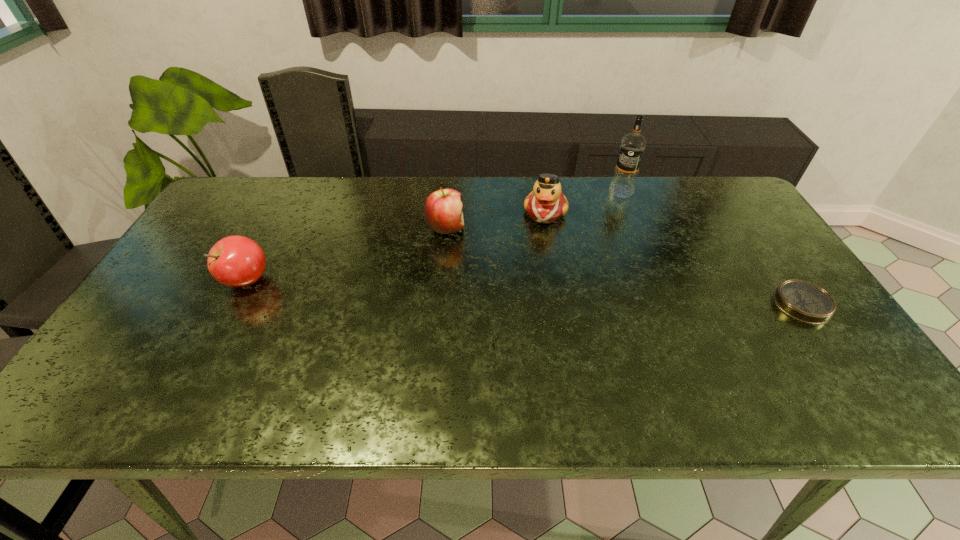
The width and height of the screenshot is (960, 540). In order to click on the leftmost object in this screenshot , I will do tap(236, 261).

At what (x,y) coordinates should I click in order to perform the action: click on the left apple. Please return your answer as a coordinate pair (x, y). This screenshot has height=540, width=960. Looking at the image, I should click on (236, 261).

Locate an element on the screen. The width and height of the screenshot is (960, 540). compass is located at coordinates (804, 301).

This screenshot has width=960, height=540. Find the location of `the rightmost object`. the rightmost object is located at coordinates (804, 301).

Find the location of `duck`. duck is located at coordinates (546, 203).

This screenshot has width=960, height=540. In order to click on vodka in this screenshot , I will do [x=633, y=145].

This screenshot has width=960, height=540. Find the location of `the fourth object from left to right`. the fourth object from left to right is located at coordinates (633, 145).

This screenshot has width=960, height=540. I want to click on the fourth object from right to left, so click(443, 213).

Where is `the right apple`? The height and width of the screenshot is (540, 960). the right apple is located at coordinates (443, 213).

Identify the location of vacant space situated on the stem of the leftmost object. The image size is (960, 540). (165, 280).